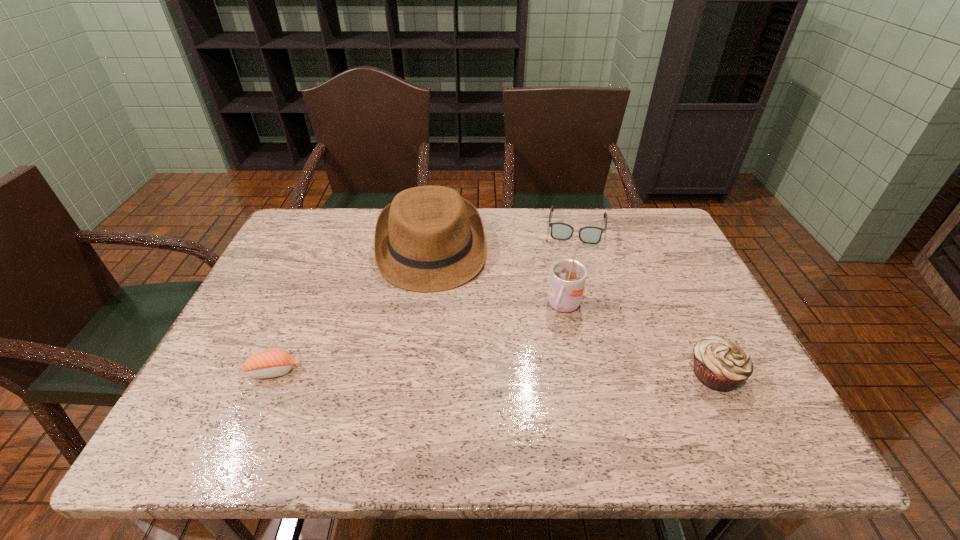
Locate an element on the screen. This screenshot has width=960, height=540. vacant region located on the face of the spectacles is located at coordinates [x=564, y=324].

Locate an element on the screen. This screenshot has height=540, width=960. vacant region located 0.150m on the side with the handle of the cup is located at coordinates (541, 369).

What are the coordinates of `vacant space located on the side with the handle of the cup` in the screenshot? It's located at (541, 369).

Locate an element on the screen. This screenshot has height=540, width=960. free region located on the side with the handle of the cup is located at coordinates (551, 347).

This screenshot has width=960, height=540. What are the coordinates of `free spot located 0.080m on the front-facing side of the second object from left to right` in the screenshot? It's located at (435, 314).

Image resolution: width=960 pixels, height=540 pixels. Identify the location of free location located on the front-facing side of the second object from left to right. (436, 329).

At what (x,y) coordinates should I click in order to perform the action: click on free space located 0.290m on the front-facing side of the second object from left to right. Please return your answer as a coordinate pair (x, y). This screenshot has height=540, width=960. Looking at the image, I should click on (441, 384).

Identify the location of spectacles at the far edge. This screenshot has height=540, width=960. (560, 231).

Identify the location of fedora that is positioned at the far edge. The image size is (960, 540). (429, 239).

This screenshot has height=540, width=960. I want to click on sushi that is positioned at the near edge, so click(x=271, y=363).